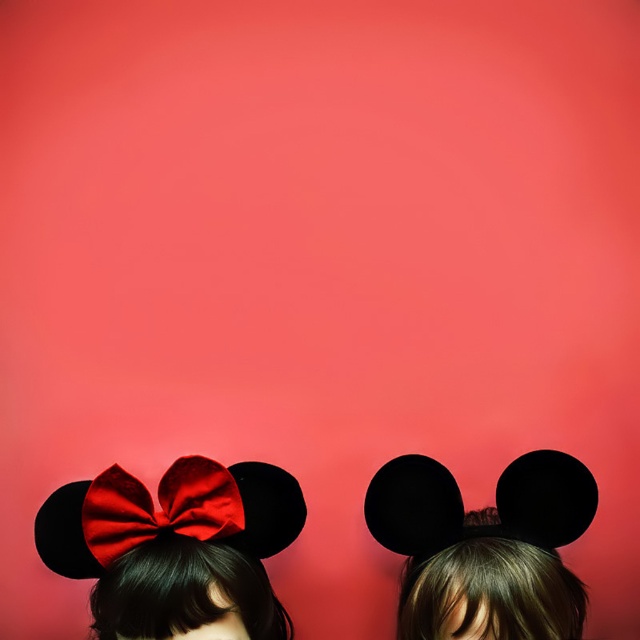
Question: Which point appears closest to the camera in this image?

Choices:
 (A) (515, 525)
 (B) (220, 493)

Answer: (B)

Question: Among these objects, which one is nearest to the camera?

Choices:
 (A) satin red bow at center
 (B) satin red bow at upper left
 (C) black matte mouse ears at center

Answer: (C)

Question: Which of the following is the closest to the observer?

Choices:
 (A) (268, 496)
 (B) (179, 488)

Answer: (B)

Question: Can you confirm if satin red bow at upper left is positioned above black matte mouse ears at center?

Choices:
 (A) yes
 (B) no

Answer: (B)

Question: Can you confirm if satin red bow at upper left is smaller than satin red bow at center?

Choices:
 (A) yes
 (B) no

Answer: (B)

Question: Is black matte mouse ears at center smaller than satin red bow at center?

Choices:
 (A) no
 (B) yes

Answer: (A)